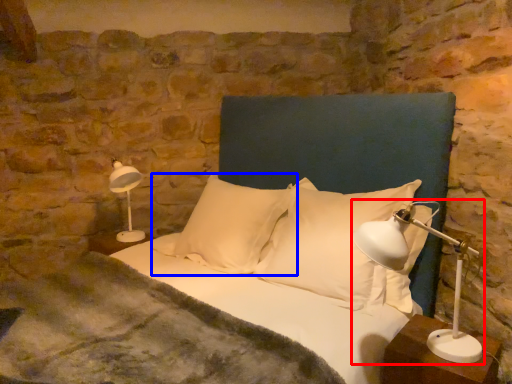
Question: Among these objects, which one is nearest to the camera, table lamp (highlighted by a red box) or pillow (highlighted by a blue box)?

Choices:
 (A) table lamp
 (B) pillow

Answer: (A)